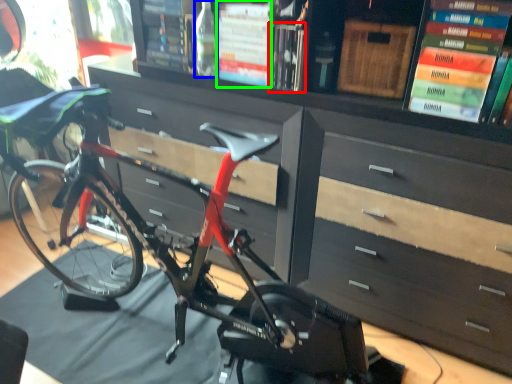
Question: Estimate the real-world distances between objects in this image. Which object is farther from book (highlighted by a red box), bottle (highlighted by a blue box) or book (highlighted by a green box)?

Choices:
 (A) bottle
 (B) book

Answer: (A)